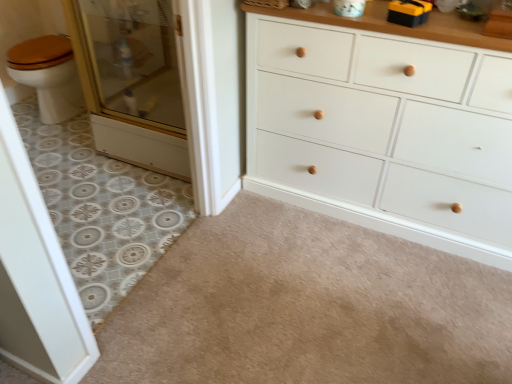
Find the location of a particular element. Image resolution: width=512 pixels, height=384 pixels. blank space above beige carpet at lower center, positioned as the second plain in left-to-right order (from a real-world perspective) is located at coordinates (280, 316).